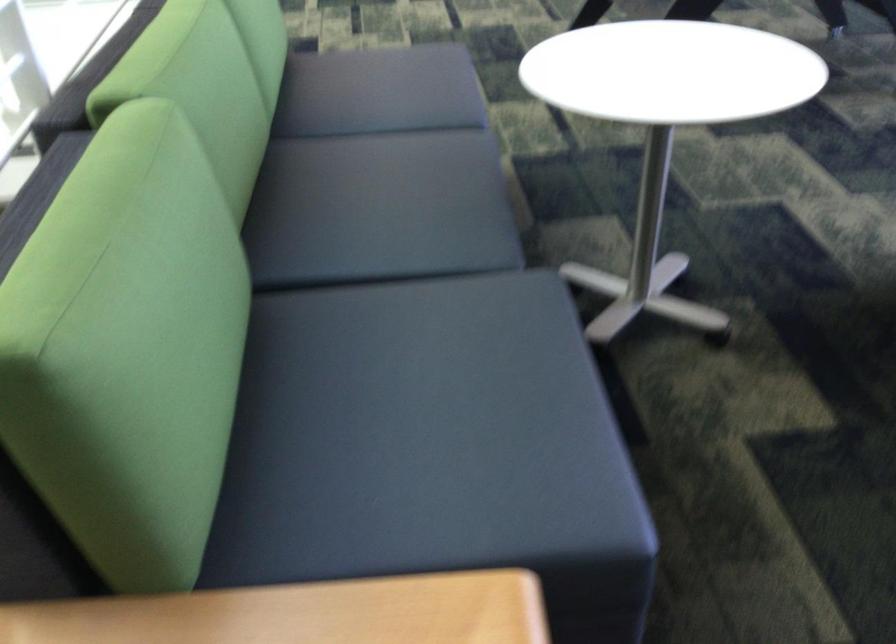
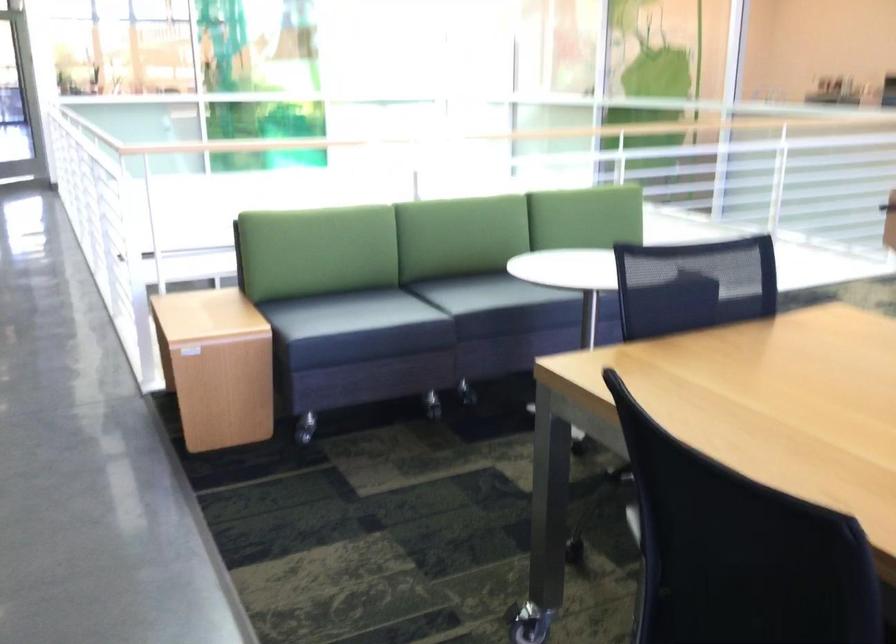
In the second image, find the point that corresponds to pixel 431 314 in the first image.

(348, 313)